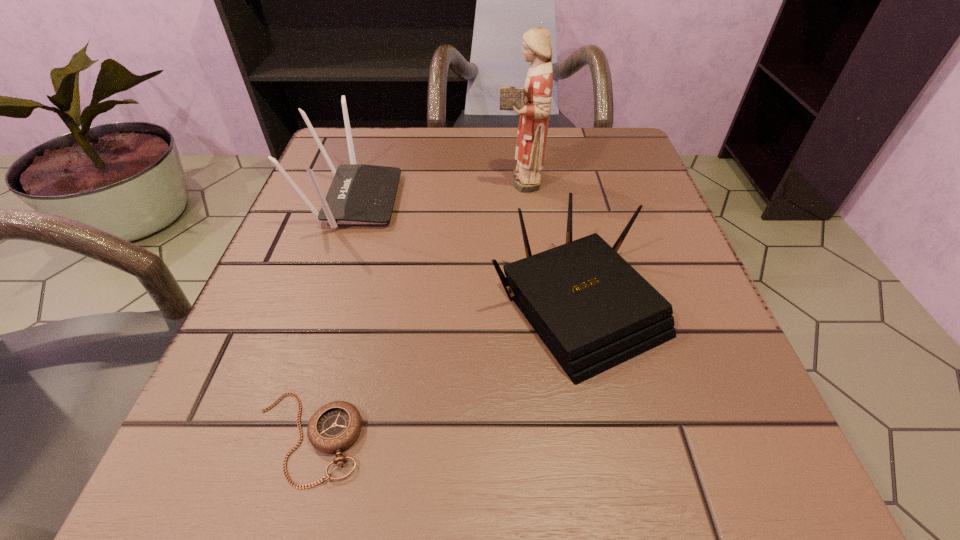
The image size is (960, 540). In order to click on object positioned at the near left corner in this screenshot , I will do `click(335, 426)`.

The width and height of the screenshot is (960, 540). I want to click on vacant space at the far edge, so click(x=502, y=183).

Locate an element on the screen. This screenshot has height=540, width=960. vacant space at the left edge of the desktop is located at coordinates (346, 276).

This screenshot has width=960, height=540. Identify the location of vacant space at the right edge of the desktop. (676, 232).

Locate an element on the screen. Image resolution: width=960 pixels, height=540 pixels. vacant space at the far left corner is located at coordinates (387, 140).

In the image, there is a desktop. Where is `vacant space at the near left corner`? The image size is (960, 540). vacant space at the near left corner is located at coordinates (286, 481).

Where is `vacant space at the far right corner`? This screenshot has height=540, width=960. vacant space at the far right corner is located at coordinates (628, 158).

Identify the location of free region at the near right corner of the desktop. Image resolution: width=960 pixels, height=540 pixels. (711, 485).

This screenshot has width=960, height=540. I want to click on free spot between the shortest object and the tallest object, so click(413, 309).

Locate an element on the screen. This screenshot has width=960, height=540. empty space that is in between the taller router and the pocket watch is located at coordinates (330, 319).